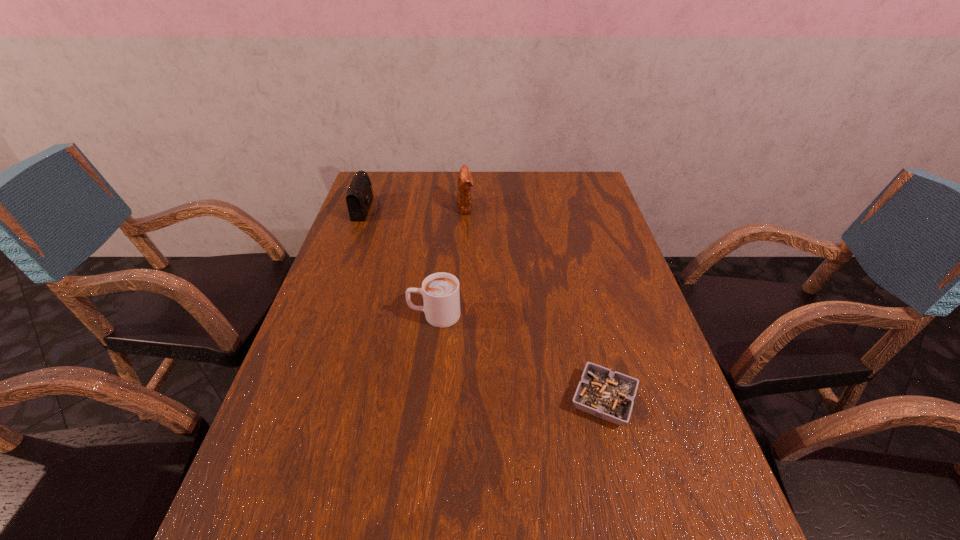
Where is `the taller clutch bag`? The width and height of the screenshot is (960, 540). the taller clutch bag is located at coordinates (465, 181).

Where is `the tallest object`? The image size is (960, 540). the tallest object is located at coordinates (465, 181).

The image size is (960, 540). I want to click on cappuccino, so click(441, 296).

At what (x,y) coordinates should I click in order to perform the action: click on the leftmost object. Please return your answer as a coordinate pair (x, y). Image resolution: width=960 pixels, height=540 pixels. Looking at the image, I should click on 359,197.

Where is `the left clutch bag`? The width and height of the screenshot is (960, 540). the left clutch bag is located at coordinates (359, 197).

Locate an element on the screen. The image size is (960, 540). ashtray is located at coordinates (609, 395).

Where is `the rightmost object`? Image resolution: width=960 pixels, height=540 pixels. the rightmost object is located at coordinates (609, 395).

At what (x,y) coordinates should I click in order to perform the action: click on blank space located 0.080m on the open side of the tallest object. Please return your answer as a coordinate pair (x, y). This screenshot has height=540, width=960. Looking at the image, I should click on (497, 207).

Find the location of a particular element. The width and height of the screenshot is (960, 540). vacant region located on the side with the handle of the second nearest object is located at coordinates (357, 315).

Where is `free space located 0.240m on the side with the handle of the second nearest object`? This screenshot has height=540, width=960. free space located 0.240m on the side with the handle of the second nearest object is located at coordinates (313, 315).